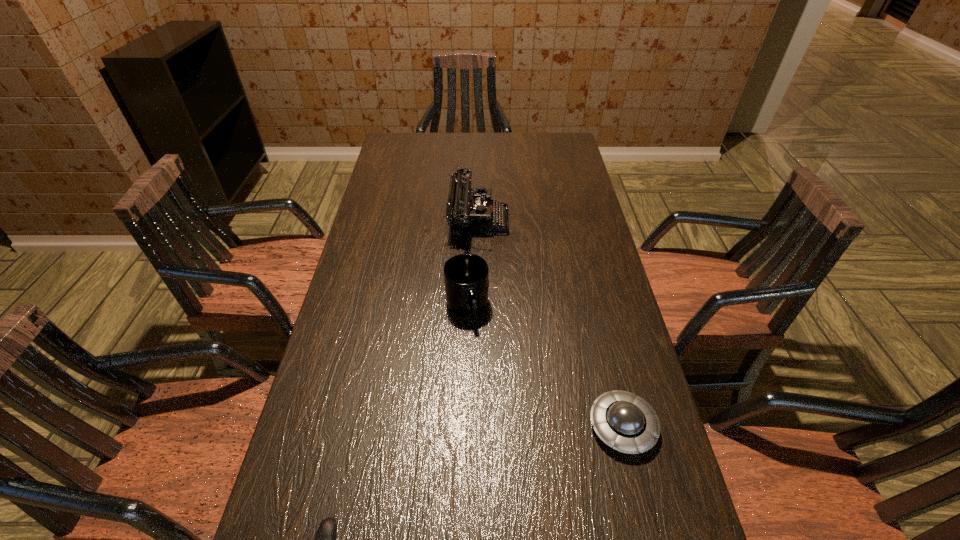
Find the location of a particular element. The image size is (960, 540). mug is located at coordinates (466, 280).

Find the location of a particular element. The image size is (960, 540). the farthest object is located at coordinates (469, 209).

The height and width of the screenshot is (540, 960). I want to click on the third farthest object, so click(622, 420).

In order to click on the third tallest object in this screenshot , I will do `click(622, 420)`.

Find the location of a particular element. blank space located 0.220m with the handle on the side of the third nearest object is located at coordinates (465, 408).

Where is `vacant space located 0.100m on the keyboard of the typewriter`? This screenshot has width=960, height=540. vacant space located 0.100m on the keyboard of the typewriter is located at coordinates (540, 220).

Identify the location of free space located 0.320m on the left of the third tallest object. Image resolution: width=960 pixels, height=540 pixels. (438, 426).

This screenshot has height=540, width=960. Find the location of `object that is at the right edge`. object that is at the right edge is located at coordinates point(622,420).

Find the location of a particular element. The width and height of the screenshot is (960, 540). free space at the far edge of the desktop is located at coordinates (445, 142).

In the image, there is a desktop. Where is `vacant space at the left edge`? vacant space at the left edge is located at coordinates (374, 343).